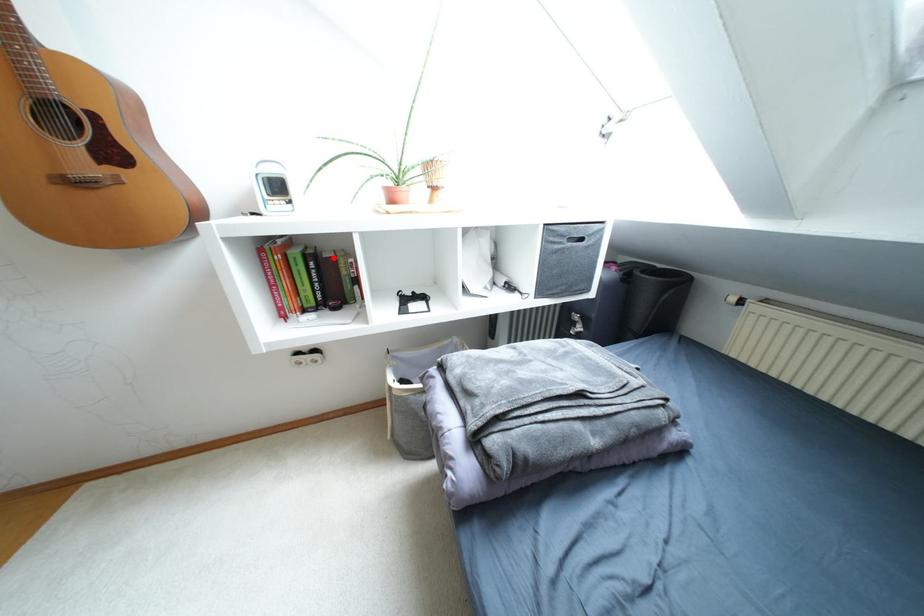
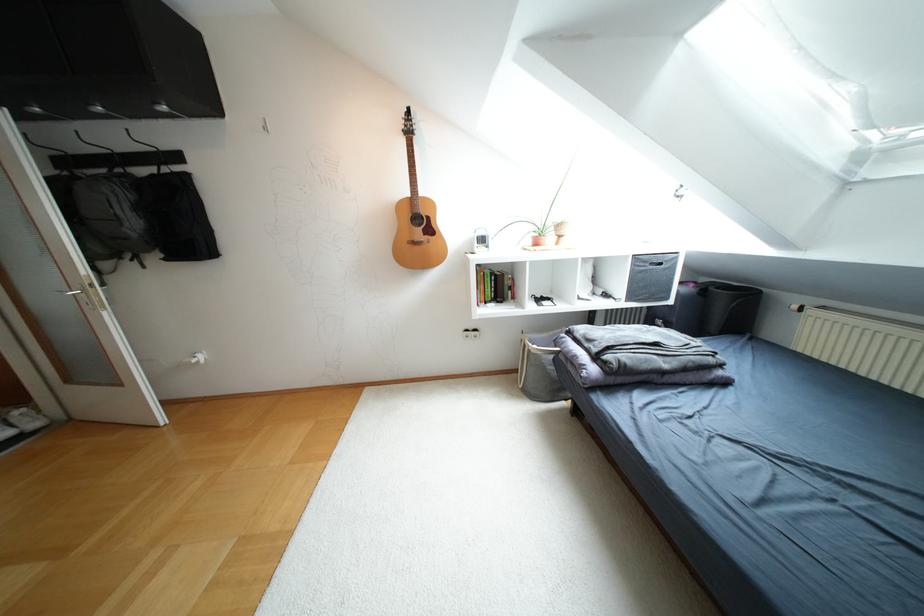
In the second image, find the point that corresponds to the highlighted location in the first image.

(502, 275)